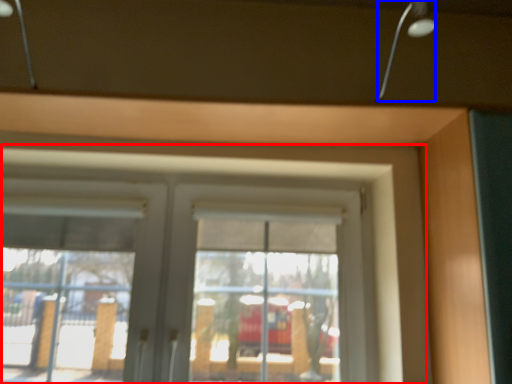
Question: Which object appears closest to the camera in this image, window (highlighted by a red box) or lamp (highlighted by a blue box)?

Choices:
 (A) window
 (B) lamp

Answer: (B)